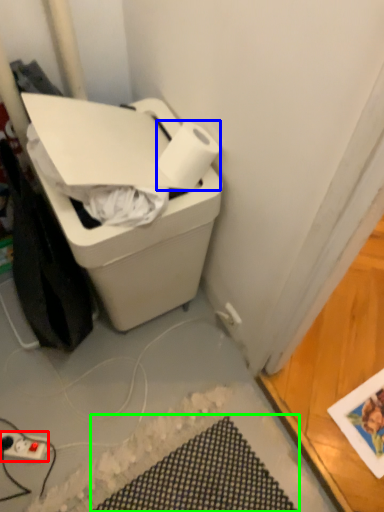
Question: Which is farther away from power plugs and sockets (highlighted by a red box)? paper towel (highlighted by a blue box) or bath mat (highlighted by a green box)?

Choices:
 (A) paper towel
 (B) bath mat

Answer: (A)